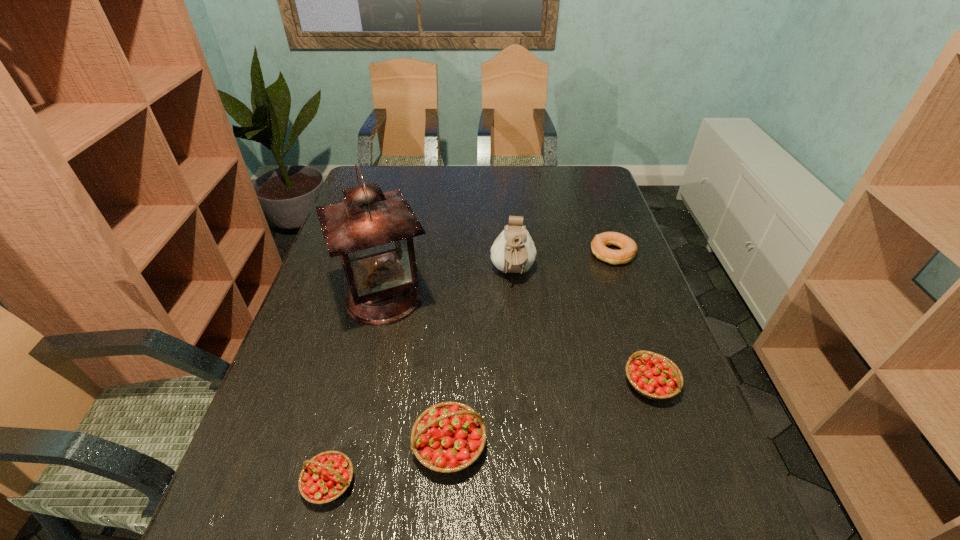
This screenshot has width=960, height=540. Find the location of `object situated at the near left corner`. object situated at the near left corner is located at coordinates (325, 477).

In the image, there is a desktop. Where is `vacant space at the far edge`? This screenshot has height=540, width=960. vacant space at the far edge is located at coordinates (561, 190).

At what (x,y) coordinates should I click in order to perform the action: click on vacant space at the near edge of the desktop. Please return your answer as a coordinate pair (x, y). Image resolution: width=960 pixels, height=540 pixels. Looking at the image, I should click on (566, 462).

In the image, there is a desktop. Where is `vacant space at the left edge`? vacant space at the left edge is located at coordinates (347, 371).

You are a GUI agent. You are given a task and a screenshot of the screen. Output one action in this format:
    pyautogui.click(x=<x>, y=<y>)
    Task: Click on the free space at the right edge of the desktop
    Image resolution: width=960 pixels, height=540 pixels.
    Given the screenshot: What is the action you would take?
    pyautogui.click(x=603, y=264)

At what (x,y) coordinates should I click in order to perform the action: click on free space at the far right corner. Please return your answer as a coordinate pair (x, y). The image size is (960, 540). Looking at the image, I should click on (602, 174).

Locate an element on the screen. vacant area that lies between the oil lamp and the bagel is located at coordinates (498, 276).

Identify the location of vacant point located between the second tallest object and the fourth tallest object. (582, 328).

Where is `empty space between the third tallest object and the third object from right to left`? empty space between the third tallest object and the third object from right to left is located at coordinates (481, 359).

At what (x,y) coordinates should I click in order to perform the action: click on free space between the second tallest strawberry and the bagel. Please return your answer as a coordinate pair (x, y). This screenshot has height=540, width=960. Looking at the image, I should click on (632, 319).